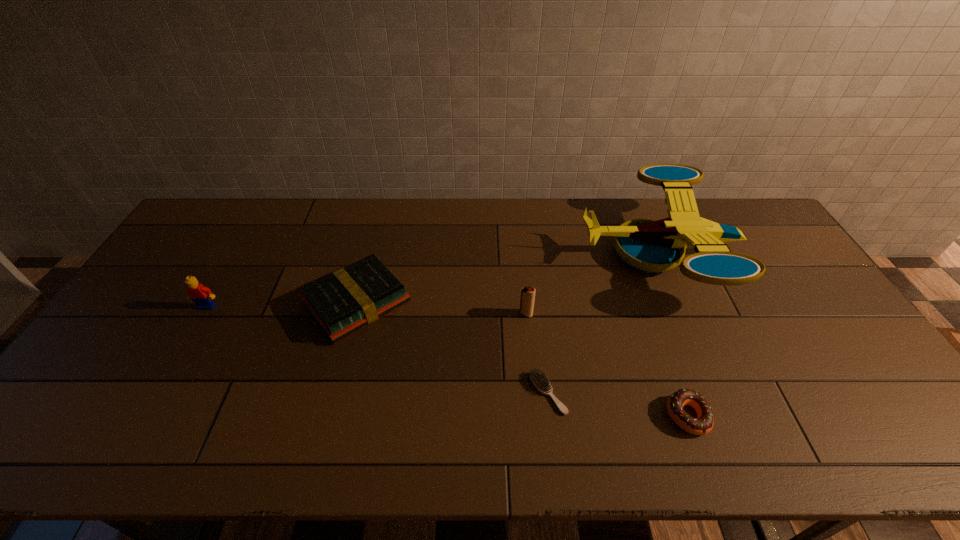
Locate an element on the screen. vacant area that lies between the igniter and the hardback book is located at coordinates (442, 308).

The image size is (960, 540). What are the coordinates of `free space between the igniter and the scrubbing brush` in the screenshot? It's located at coord(537,353).

Where is `object that is the fifth closest one to the leftmost object`? The height and width of the screenshot is (540, 960). object that is the fifth closest one to the leftmost object is located at coordinates (703, 424).

Find the location of a particular element. Image resolution: width=960 pixels, height=540 pixels. object identified as the third closest to the doughnut is located at coordinates (527, 299).

Find the location of `free space that satisfies the following two spatial constraints: 1. on the face of the leftmost object; 2. on the right side of the igniter`. free space that satisfies the following two spatial constraints: 1. on the face of the leftmost object; 2. on the right side of the igniter is located at coordinates (203, 314).